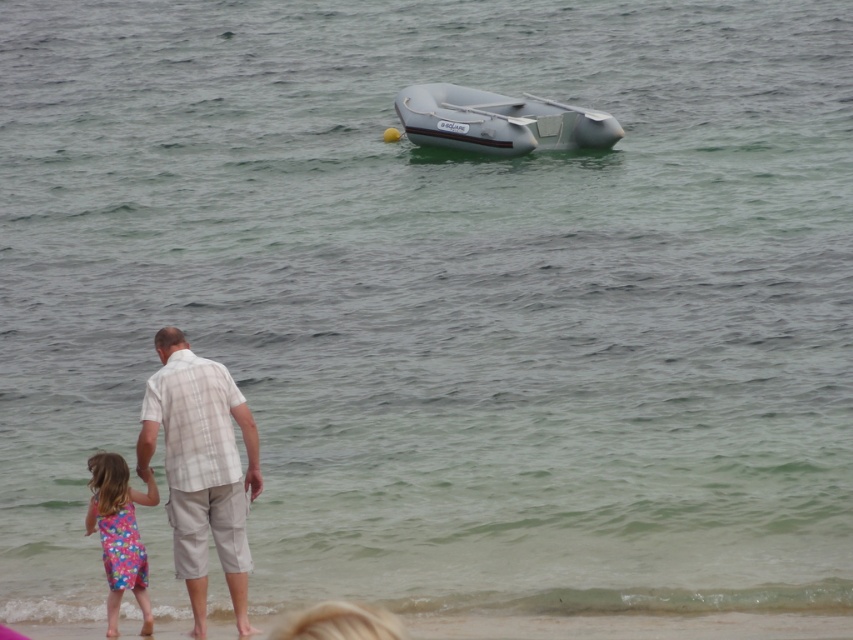
You are standing at the beach and want to walk towards the inflatable boat. There are two points marked on the sand. One is at point (238,618) and the other is at point (469,104). Which point should you head towards to reach the boat more quickly?

Point (238,618) is in front of point (469,104), so you should head towards point (238,618) to reach the boat more quickly.